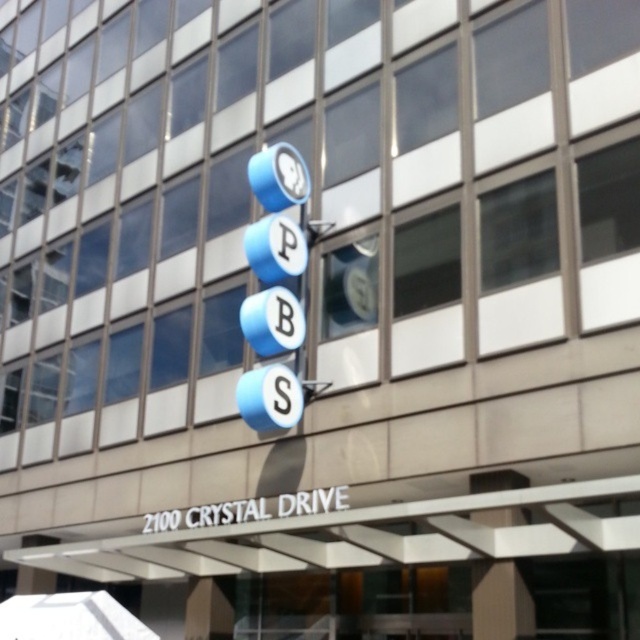
Between blue metallic clock at upper center and metallic blue clock at center, which one has less height?

With less height is metallic blue clock at center.

Measure the distance between blue metallic clock at upper center and camera.

blue metallic clock at upper center is 11.34 meters from camera.

Where is `blue metallic clock at upper center`? The height and width of the screenshot is (640, 640). blue metallic clock at upper center is located at coordinates (278, 177).